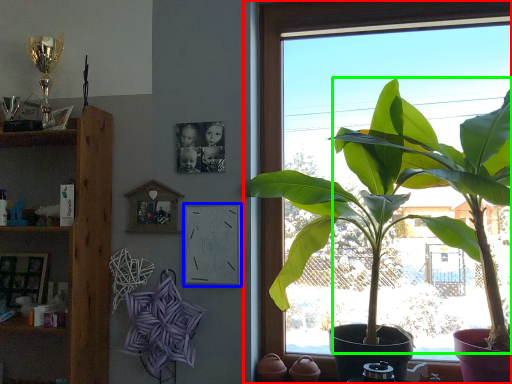
Question: Considering the real-world distances, which object is closest to window (highlighted by a red box)? picture frame (highlighted by a blue box) or banana tree (highlighted by a green box).

Choices:
 (A) picture frame
 (B) banana tree

Answer: (A)